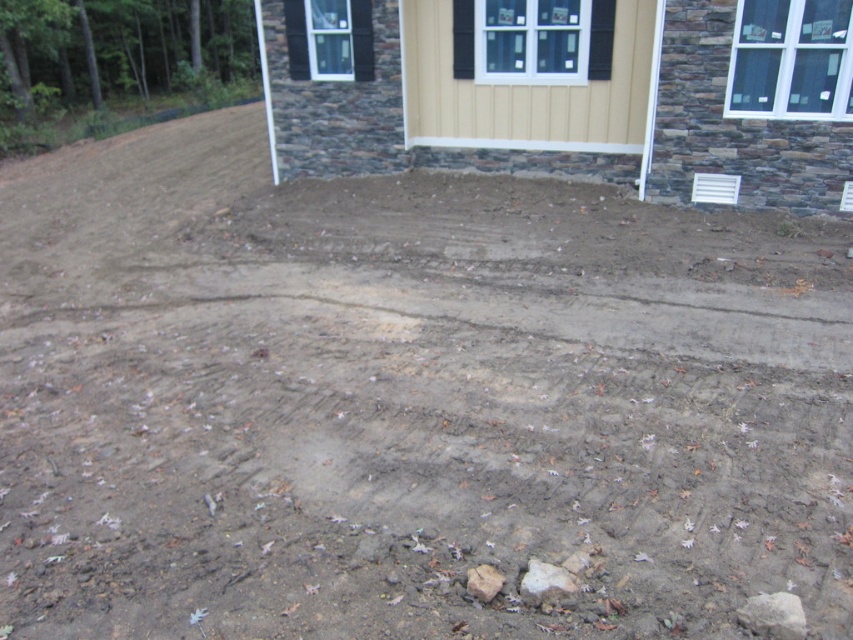
Is point (762, 608) closer to viewer compared to point (477, 577)?

Yes, it is.

Can you confirm if gray rough stone at lower right is bigger than gray rough stone at lower center?

Yes, gray rough stone at lower right is bigger than gray rough stone at lower center.

The width and height of the screenshot is (853, 640). What are the coordinates of `gray rough stone at lower right` in the screenshot? It's located at (773, 616).

Between gray rough stone at lower right and gray rough rock at lower center, which one has more height?

gray rough rock at lower center is taller.

Between gray rough stone at lower right and gray rough rock at lower center, which one appears on the right side from the viewer's perspective?

Positioned to the right is gray rough stone at lower right.

Identify the location of gray rough stone at lower right. The width and height of the screenshot is (853, 640). (773, 616).

Image resolution: width=853 pixels, height=640 pixels. In order to click on gray rough stone at lower right in this screenshot , I will do `click(773, 616)`.

Which is more to the left, gray rough rock at lower center or gray rough stone at lower center?

Positioned to the left is gray rough stone at lower center.

Does gray rough rock at lower center have a lesser height compared to gray rough stone at lower center?

No.

Describe the element at coordinates (546, 582) in the screenshot. I see `gray rough rock at lower center` at that location.

Locate an element on the screen. gray rough rock at lower center is located at coordinates (546, 582).